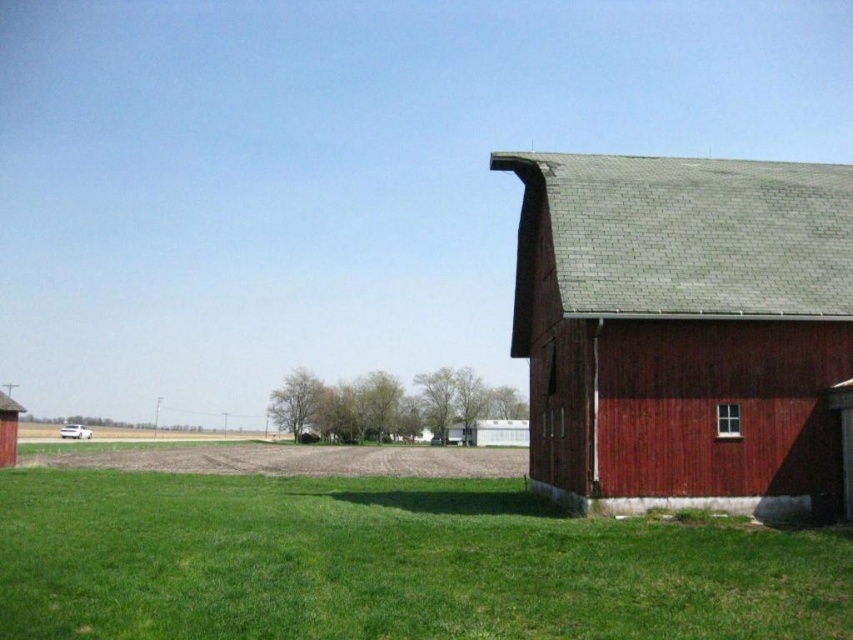
Who is higher up, green grass at lower right or rustic wood barn at lower left?

green grass at lower right is above.

Is point (837, 547) positioned behind point (16, 435)?

No, (837, 547) is in front of (16, 435).

You are a GUI agent. You are given a task and a screenshot of the screen. Output one action in this format:
    pyautogui.click(x=<x>, y=<y>)
    Task: Click on the green grass at lower right
    Image resolution: width=853 pixels, height=640 pixels.
    Given the screenshot: What is the action you would take?
    pyautogui.click(x=392, y=563)

Who is positioned more to the left, green grass at lower right or smooth red barn at right?

Positioned to the left is green grass at lower right.

Is green grass at lower right wider than smooth red barn at right?

Yes.

Does point (688, 556) come closer to viewer compared to point (631, 435)?

Yes, point (688, 556) is closer to viewer.

The image size is (853, 640). What are the coordinates of `green grass at lower right` in the screenshot? It's located at (392, 563).

What do you see at coordinates (683, 330) in the screenshot? I see `smooth red barn at right` at bounding box center [683, 330].

Measure the distance between smooth red barn at right and camera.

smooth red barn at right and camera are 17.67 meters apart from each other.

Image resolution: width=853 pixels, height=640 pixels. What are the coordinates of `smooth red barn at right` in the screenshot? It's located at (683, 330).